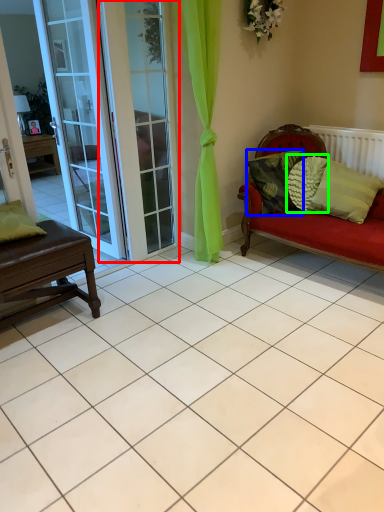
Question: Which object is positioned closest to screen door (highlighted by a red box)? Select from pillow (highlighted by a blue box) and pillow (highlighted by a green box).

Choices:
 (A) pillow
 (B) pillow

Answer: (A)